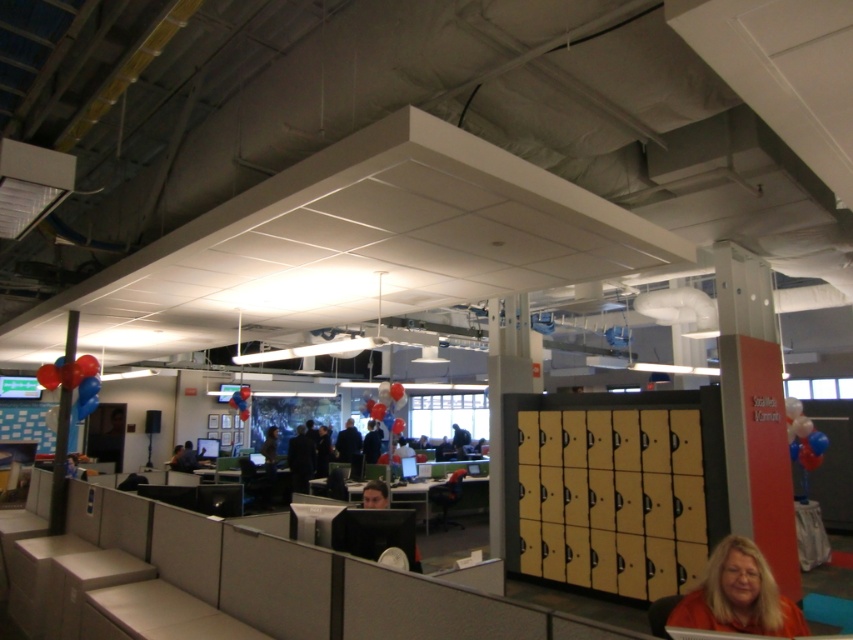
Can you confirm if matte black desk at center is smaller than shiny metallic balloons at left?

No.

The image size is (853, 640). Find the location of `matte black desk at center`. matte black desk at center is located at coordinates pyautogui.click(x=416, y=499).

This screenshot has height=640, width=853. What are the coordinates of `matte black desk at center` in the screenshot? It's located at (416, 499).

Which is below, matte black monitor at center or red glossy balloon at center?

Positioned lower is matte black monitor at center.

Image resolution: width=853 pixels, height=640 pixels. What do you see at coordinates (375, 493) in the screenshot?
I see `matte black monitor at center` at bounding box center [375, 493].

The height and width of the screenshot is (640, 853). Find the location of `matte black monitor at center`. matte black monitor at center is located at coordinates (375, 493).

Measure the distance from orange fabric at lower right to matte black desk at center.

9.02 meters

Is orange fabric at lower right smaller than matte black desk at center?

Yes, orange fabric at lower right is smaller than matte black desk at center.

Which is behind, point (718, 609) or point (456, 508)?

The point (456, 508) is more distant.

This screenshot has width=853, height=640. Identify the location of orange fabric at lower right. (738, 595).